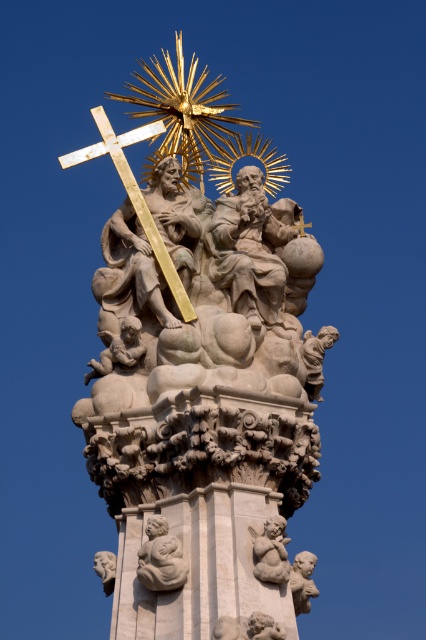
Can you confirm if white stone sculpture at center is smaller than smooth stone cherub at lower left?

Actually, white stone sculpture at center might be larger than smooth stone cherub at lower left.

Can you confirm if white stone sculpture at center is wider than smooth stone cherub at lower left?

Indeed, white stone sculpture at center has a greater width compared to smooth stone cherub at lower left.

Image resolution: width=426 pixels, height=640 pixels. I want to click on white stone sculpture at center, so click(201, 378).

Who is more distant from viewer, (161, 244) or (112, 577)?

Positioned behind is point (161, 244).

Which of these two, gold polished cross at upper center or smooth stone cherub at lower left, stands taller?

gold polished cross at upper center is taller.

Identify the location of gold polished cross at upper center. (134, 193).

Does white stone sculpture at center have a greater height compared to gold polished cross at upper center?

Yes.

Is white stone sculpture at center shorter than gold polished cross at upper center?

Incorrect, white stone sculpture at center's height does not fall short of gold polished cross at upper center's.

Who is more forward, (218, 360) or (129, 188)?

Positioned in front is point (218, 360).

Where is `white stone sculpture at center`? white stone sculpture at center is located at coordinates (201, 378).